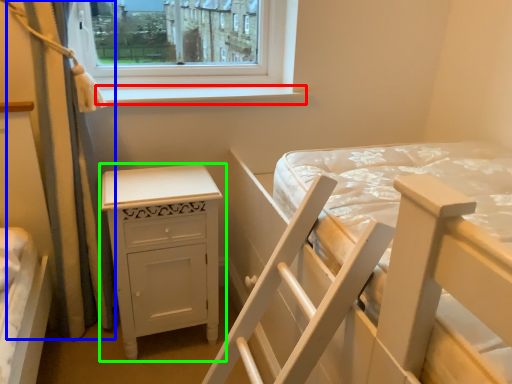
Question: Based on their relative distances, which object is farther from window sill (highlighted by a red box)? Choose from curtain (highlighted by a blue box) and nightstand (highlighted by a green box).

Choices:
 (A) curtain
 (B) nightstand

Answer: (B)